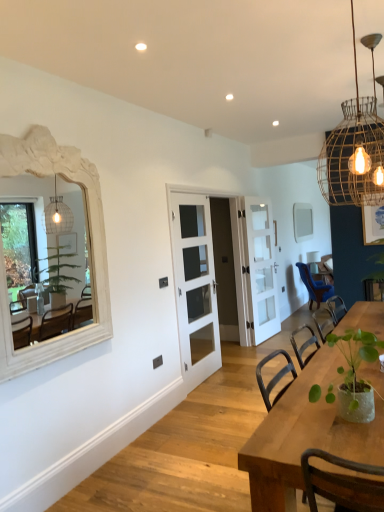
Identify the location of unoccupied space behind green matte plant at lower right. (308, 395).